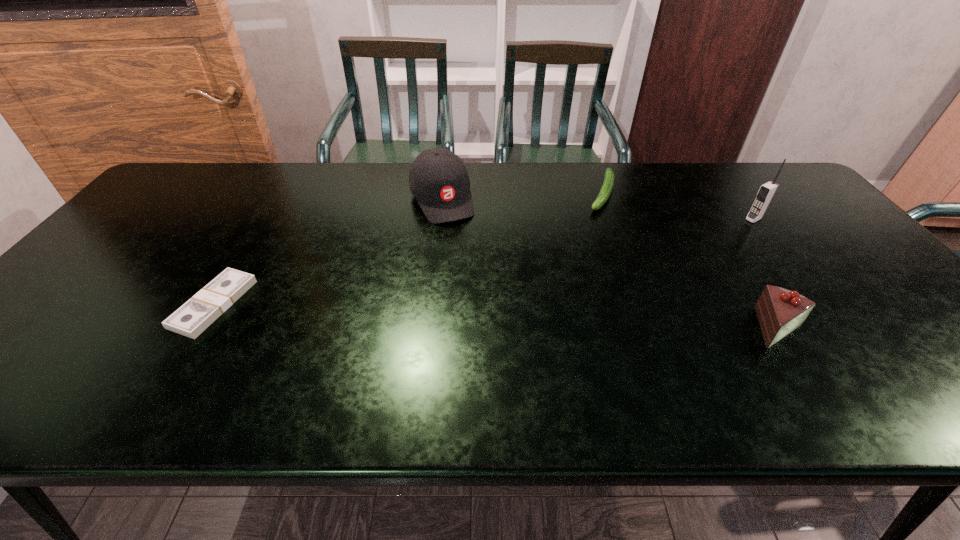
Locate an element on the screen. The image size is (960, 540). the leftmost object is located at coordinates (200, 311).

Identify the location of dollar. (200, 311).

What are the coordinates of `the fourth object from left to right` in the screenshot? It's located at (780, 311).

This screenshot has width=960, height=540. Identify the location of chocolate cake. (780, 311).

Where is `zucchini`? zucchini is located at coordinates (606, 189).

This screenshot has width=960, height=540. What are the coordinates of `the second shortest object` in the screenshot? It's located at (606, 189).

You are a GUI agent. You are given a task and a screenshot of the screen. Output one action in this format:
    pyautogui.click(x=<x>, y=<y>)
    Task: Click on the second tallest object
    The image size is (960, 540).
    Given the screenshot: What is the action you would take?
    pyautogui.click(x=438, y=179)

This screenshot has height=540, width=960. I want to click on the fourth object from right to left, so click(438, 179).

Identify the location of cellular telephone. The image size is (960, 540). (767, 191).

Locate an element on the screen. The image size is (960, 540). the rightmost object is located at coordinates (767, 191).